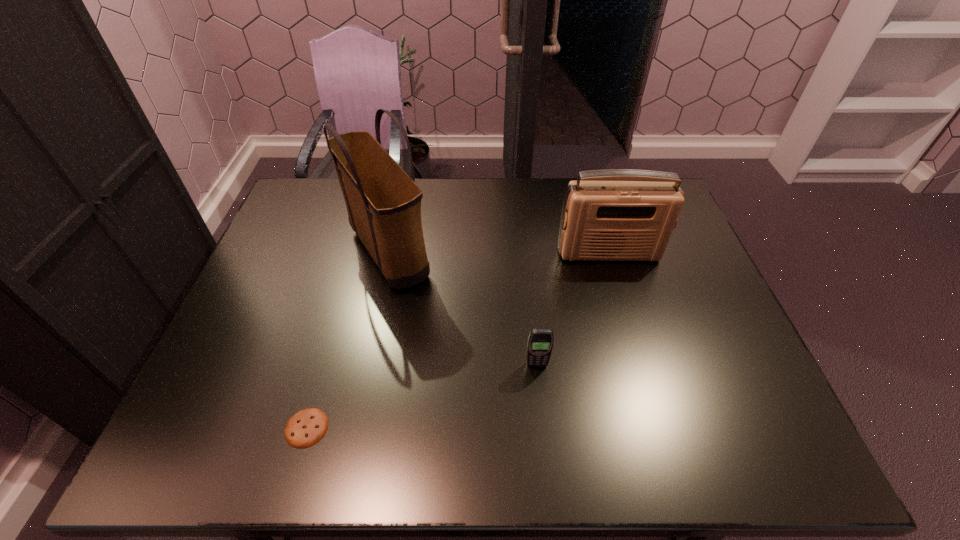
Where is `vacant region between the second object from right to left and the tallest object`? The image size is (960, 540). vacant region between the second object from right to left and the tallest object is located at coordinates (463, 308).

Locate an element on the screen. This screenshot has width=960, height=540. free point between the nearest object and the tallest object is located at coordinates (348, 340).

You are a GUI agent. You are given a task and a screenshot of the screen. Output one action in this format:
    pyautogui.click(x=<x>, y=<y>)
    Task: Click on the empty location between the radio receiver and the cookie
    This screenshot has width=960, height=540.
    Given the screenshot: What is the action you would take?
    pyautogui.click(x=458, y=340)

Image resolution: width=960 pixels, height=540 pixels. I want to click on empty space that is in between the third farthest object and the cookie, so click(421, 396).

At what (x,y) coordinates should I click in order to perform the action: click on vacant region between the second tallest object and the tote bag. Please return your answer as a coordinate pair (x, y). The width and height of the screenshot is (960, 540). Looking at the image, I should click on (498, 252).

This screenshot has width=960, height=540. What are the coordinates of `vacant space in between the second shortest object and the tallest object` in the screenshot? It's located at (463, 308).

The image size is (960, 540). What are the coordinates of `blank region between the tallest object and the third object from left to right` in the screenshot? It's located at (463, 308).

Identify the location of vacant space that's between the tote bag and the second tallest object. The width and height of the screenshot is (960, 540). click(x=498, y=252).

What are the coordinates of `free space between the shortest object and the second object from right to left` in the screenshot? It's located at (421, 396).

Where is `the third closest object relative to the third shortest object`? The width and height of the screenshot is (960, 540). the third closest object relative to the third shortest object is located at coordinates (305, 428).